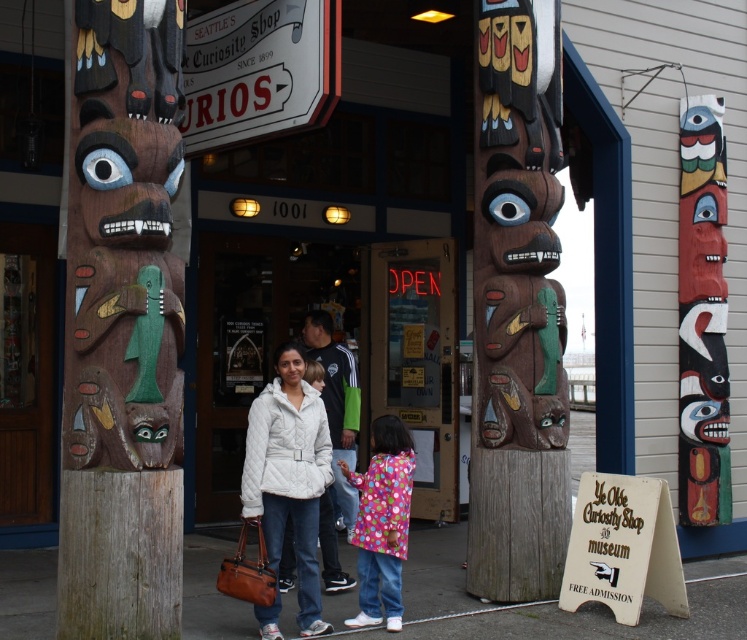
Question: From the image, what is the correct spatial relationship of wooden totem pole at center in relation to polka dot coat at center?

Choices:
 (A) below
 (B) above

Answer: (B)

Question: Can you confirm if wooden totem pole at left is bigger than wooden totem pole at center?

Choices:
 (A) no
 (B) yes

Answer: (A)

Question: Which object is positioned farthest from the polka dot coat at center?

Choices:
 (A) wooden totem pole at center
 (B) white quilted jacket at center

Answer: (A)

Question: Can you confirm if wooden totem pole at left is positioned to the left of wooden totem pole at center?

Choices:
 (A) yes
 (B) no

Answer: (A)

Question: Which object is positioned closest to the wooden totem pole at left?

Choices:
 (A) white quilted jacket at center
 (B) wooden totem pole at center

Answer: (A)

Question: Which object is closer to the camera taking this photo?

Choices:
 (A) wooden totem pole at center
 (B) white quilted jacket at center
 (C) polka dot coat at center
 (D) wooden totem pole at left

Answer: (D)